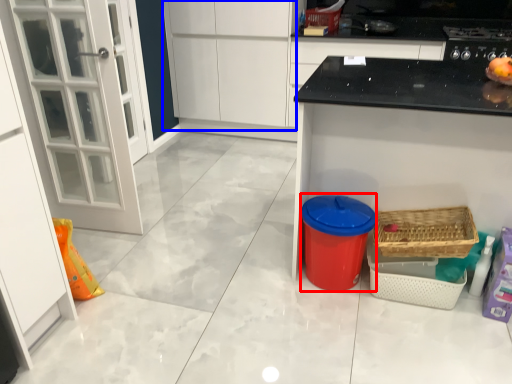
Question: Which object is closer to the camera taking this photo, appliance (highlighted by a red box) or cabinetry (highlighted by a blue box)?

Choices:
 (A) appliance
 (B) cabinetry

Answer: (A)